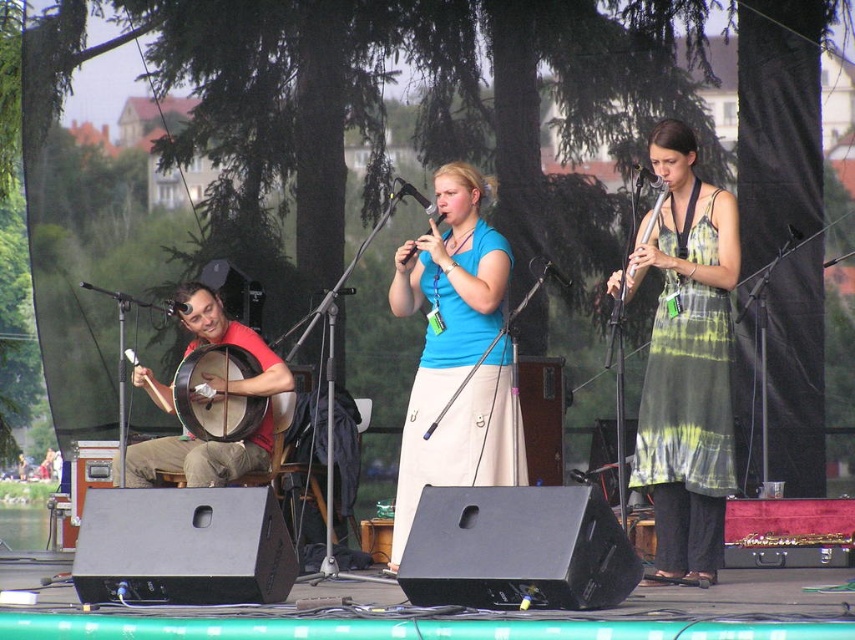
Question: Can you confirm if matte red banjo at left is positioned to the right of wooden flute at right?

Choices:
 (A) yes
 (B) no

Answer: (B)

Question: Which object is the closest to the matte blue flute at center?

Choices:
 (A) black drum at left
 (B) green tie-dye dress at center
 (C) matte red banjo at left

Answer: (B)

Question: Considering the relative positions of matte blue shirt at center and wooden flute at right in the image provided, where is matte blue shirt at center located with respect to wooden flute at right?

Choices:
 (A) left
 (B) right

Answer: (A)

Question: Which point is farther from the camera taking this photo?

Choices:
 (A) (435, 356)
 (B) (441, 216)
 (C) (634, 248)
 (D) (215, 458)

Answer: (D)

Question: Can you confirm if green tie-dye dress at center is bigger than wooden flute at right?

Choices:
 (A) yes
 (B) no

Answer: (A)

Question: Which object is closer to the camera taking this photo?

Choices:
 (A) matte red banjo at left
 (B) green tie-dye dress at center
 (C) black drum at left
 (D) matte blue flute at center

Answer: (B)